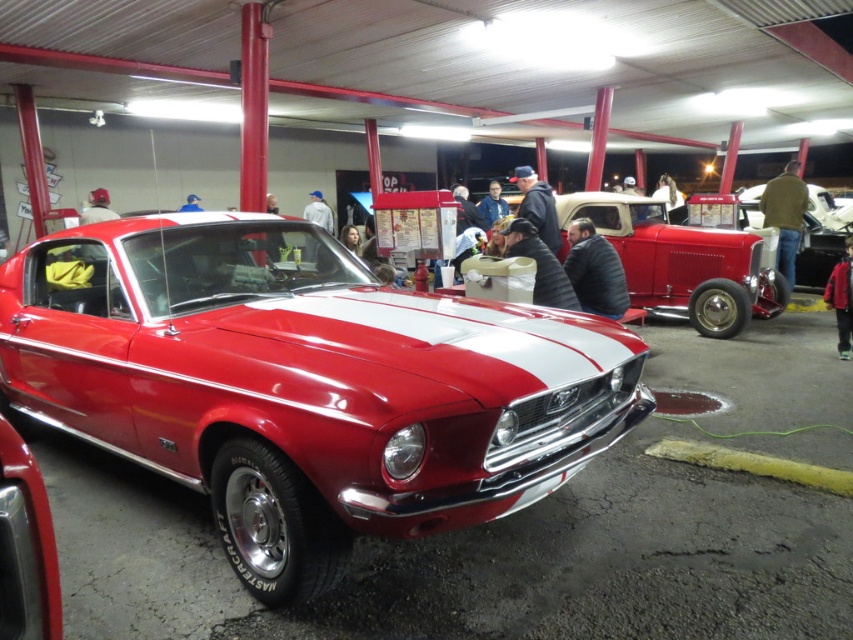
Question: Which point is farther from the camera taking this photo?

Choices:
 (A) (573, 307)
 (B) (804, 200)

Answer: (B)

Question: Observing the image, what is the correct spatial positioning of shiny red car at center in reference to brown leather jacket at right?

Choices:
 (A) right
 (B) left

Answer: (B)

Question: Among these points, which one is nearest to the camera?

Choices:
 (A) (616, 285)
 (B) (555, 259)
 (C) (332, 234)

Answer: (B)

Question: Can you confirm if brown leather jacket at right is thinner than black leather jacket at center?

Choices:
 (A) no
 (B) yes

Answer: (A)

Question: Can you confirm if matte black jacket at center is positioned to the left of red leather jacket at lower right?

Choices:
 (A) no
 (B) yes

Answer: (B)

Question: Among these objects, which one is farthest from the camera?

Choices:
 (A) gray fabric jacket at center
 (B) brown leather jacket at right

Answer: (B)